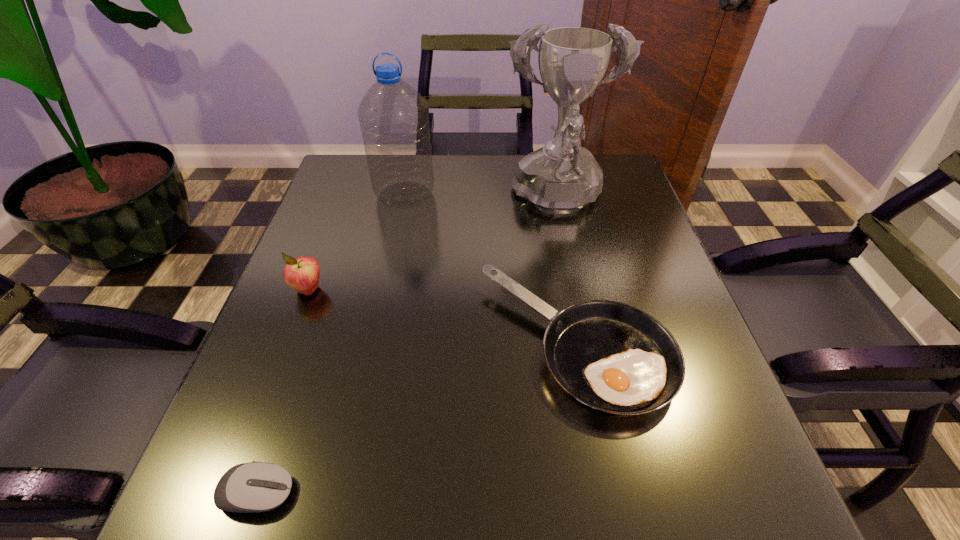
Locate an element on the screen. vacant area located 0.150m on the wheel side of the nearest object is located at coordinates (396, 493).

This screenshot has width=960, height=540. In order to click on award present at the far edge in this screenshot , I will do `click(562, 177)`.

This screenshot has width=960, height=540. Find the location of `water jug positioned at the far edge`. water jug positioned at the far edge is located at coordinates (394, 120).

The width and height of the screenshot is (960, 540). What are the coordinates of `object at the near edge` in the screenshot? It's located at click(x=253, y=487).

Find the location of a particular element. This screenshot has height=540, width=960. water jug at the left edge is located at coordinates (394, 120).

Locate an element on the screen. apple present at the left edge is located at coordinates (302, 274).

Find the location of a particular element. The width and height of the screenshot is (960, 540). computer equipment that is positioned at the left edge is located at coordinates (253, 487).

Image resolution: width=960 pixels, height=540 pixels. Find the location of `award that is at the right edge`. award that is at the right edge is located at coordinates (562, 177).

This screenshot has height=540, width=960. I want to click on frying pan situated at the right edge, so click(x=613, y=357).

You are a GUI agent. You are given a task and a screenshot of the screen. Output one action in this format:
    pyautogui.click(x=<x>, y=<y>)
    Task: Click on the object present at the far left corner
    The height and width of the screenshot is (540, 960).
    Given the screenshot: What is the action you would take?
    pyautogui.click(x=394, y=120)